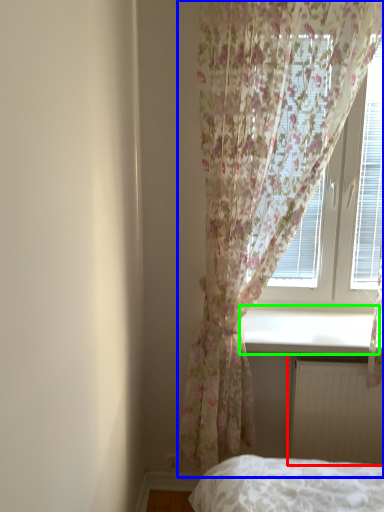
Question: Which is nearer to the radiator (highlighted by a red box)? curtain (highlighted by a blue box) or window sill (highlighted by a green box).

Choices:
 (A) curtain
 (B) window sill

Answer: (B)